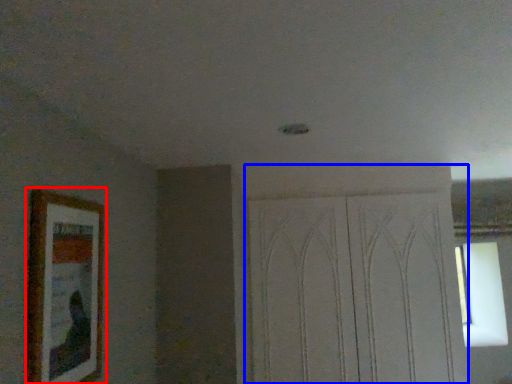
Question: Which of the following is the closest to the observer, picture frame (highlighted by a red box) or screen door (highlighted by a blue box)?

Choices:
 (A) picture frame
 (B) screen door

Answer: (A)